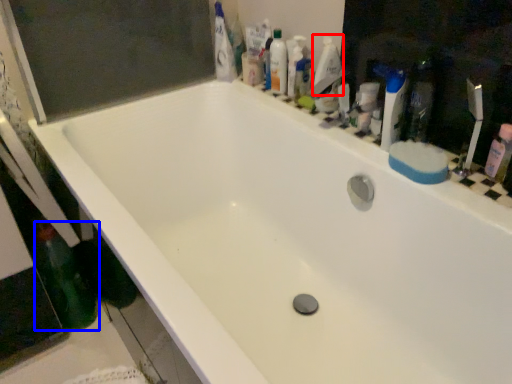
Question: Which point is further to the camera, cleaning product (highlighted by a red box) or bottle (highlighted by a blue box)?

Choices:
 (A) cleaning product
 (B) bottle

Answer: (A)